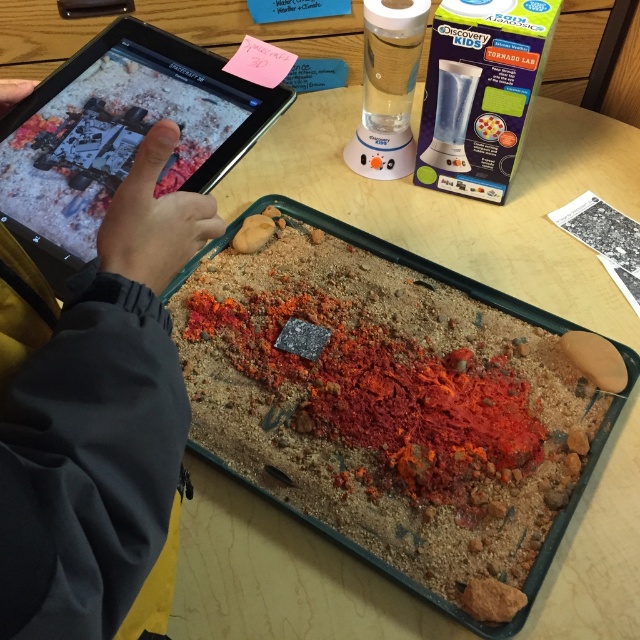
Between black glossy tablet at upper left and granular sand tray at center, which one is positioned lower?

granular sand tray at center

Is point (205, 70) positioned after point (488, 292)?

No, (205, 70) is closer to viewer.

The width and height of the screenshot is (640, 640). Describe the element at coordinates (120, 134) in the screenshot. I see `black glossy tablet at upper left` at that location.

This screenshot has width=640, height=640. Identify the location of black glossy tablet at upper left. (120, 134).

Which is more to the right, gray fabric hand at upper left or black glossy tablet at upper left?

Positioned to the right is gray fabric hand at upper left.

Is gray fabric hand at upper left above black glossy tablet at upper left?

No, gray fabric hand at upper left is not above black glossy tablet at upper left.

The height and width of the screenshot is (640, 640). Describe the element at coordinates (96, 417) in the screenshot. I see `gray fabric hand at upper left` at that location.

At what (x,y) coordinates should I click in order to perform the action: click on gray fabric hand at upper left. Please return your answer as a coordinate pair (x, y). The image size is (640, 640). Looking at the image, I should click on (96, 417).

This screenshot has height=640, width=640. Describe the element at coordinates (96, 417) in the screenshot. I see `gray fabric hand at upper left` at that location.

Based on the photo, who is more distant from viewer, (141, 403) or (224, 468)?

The point (224, 468) is behind.

This screenshot has width=640, height=640. Identify the location of gray fabric hand at upper left. (96, 417).